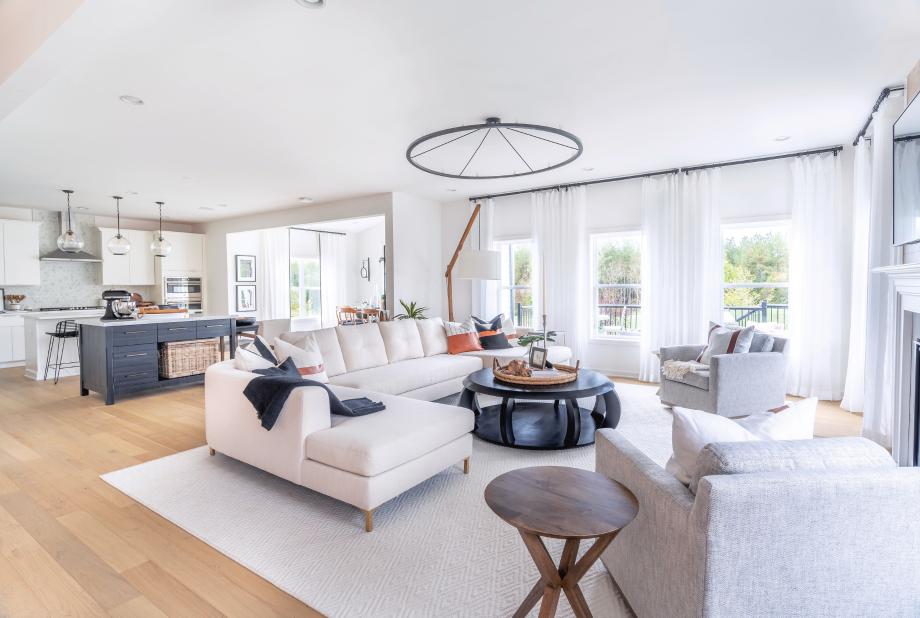
The width and height of the screenshot is (920, 618). What are the coordinates of `couch` in the screenshot? It's located at (374, 362).